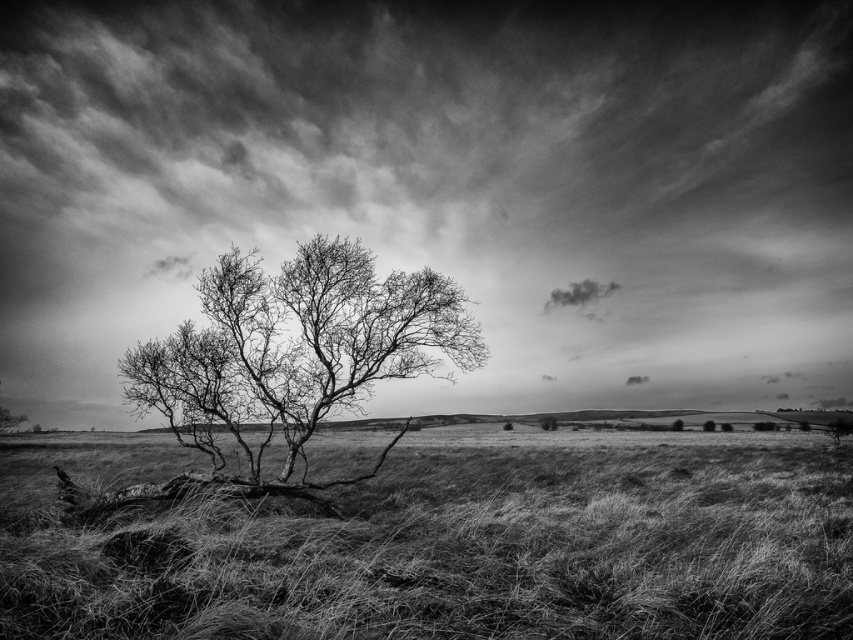
Who is more distant from viewer, (x=146, y=504) or (x=259, y=280)?

The point (x=259, y=280) is more distant.

Does fuzzy grass at lower left have a lesser height compared to bare branches at center?

Yes.

Is point (32, 588) closer to camera compared to point (288, 308)?

That is True.

This screenshot has width=853, height=640. Identify the location of fuzzy grass at lower left. (444, 541).

Is point (795, 93) farther from camera compared to point (219, 396)?

Yes, it is behind point (219, 396).

Is point (587, 397) farther from viewer compared to point (193, 416)?

Yes, point (587, 397) is behind point (193, 416).

Image resolution: width=853 pixels, height=640 pixels. Identify the location of cloudy sky at upper center. (439, 186).

Does fuzzy grass at lower left appear over fuzzy white cloud at upper center?

Actually, fuzzy grass at lower left is below fuzzy white cloud at upper center.

Is point (268, 593) closer to viewer compared to point (573, 292)?

Yes, point (268, 593) is in front of point (573, 292).

Where is `fuzzy grass at lower left`? This screenshot has width=853, height=640. fuzzy grass at lower left is located at coordinates (444, 541).

You are a GUI agent. You are given a task and a screenshot of the screen. Output one action in this format:
    pyautogui.click(x=<x>, y=<y>)
    Task: Click on the fuzzy grass at lower left
    The height and width of the screenshot is (640, 853).
    Given the screenshot: What is the action you would take?
    pyautogui.click(x=444, y=541)